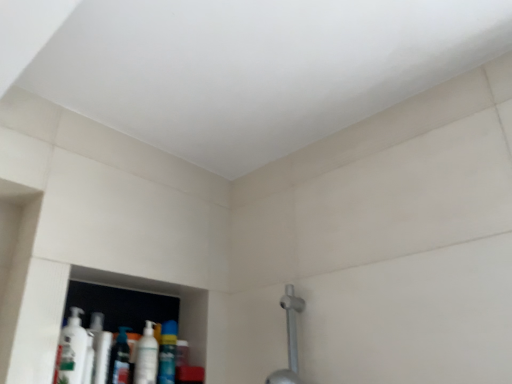
Question: Considering the relative sizes of white glossy mouthwash at lower left, arranged as the 1th mouthwash when viewed from the left, and white glossy mouthwash at lower left, which is the 2th mouthwash in right-to-left order, in the image provided, is white glossy mouthwash at lower left, arranged as the 1th mouthwash when viewed from the left, taller than white glossy mouthwash at lower left, which is the 2th mouthwash in right-to-left order,?

Choices:
 (A) no
 (B) yes

Answer: (B)

Question: Can you confirm if white glossy mouthwash at lower left, acting as the 4th mouthwash starting from the right, is positioned to the left of white glossy mouthwash at lower left, acting as the third mouthwash starting from the left?

Choices:
 (A) no
 (B) yes

Answer: (B)

Question: Can you confirm if white glossy mouthwash at lower left, acting as the 4th mouthwash starting from the right, is smaller than white glossy mouthwash at lower left, which is the 2th mouthwash in right-to-left order?

Choices:
 (A) yes
 (B) no

Answer: (B)

Question: Can you confirm if white glossy mouthwash at lower left, acting as the 4th mouthwash starting from the right, is positioned to the right of white glossy mouthwash at lower left, acting as the third mouthwash starting from the left?

Choices:
 (A) no
 (B) yes

Answer: (A)

Question: From the image's perspective, is white glossy mouthwash at lower left, acting as the 4th mouthwash starting from the right, located beneath white glossy mouthwash at lower left, acting as the third mouthwash starting from the left?

Choices:
 (A) no
 (B) yes

Answer: (A)

Question: Is point click(142, 374) positioned closer to the camera than point click(158, 380)?

Choices:
 (A) closer
 (B) farther

Answer: (A)

Question: Based on their positions, is white glossy mouthwash at lower left, which is the 2th mouthwash in right-to-left order, located to the left or right of blue glossy mouthwash at lower left, which appears as the 4th mouthwash when viewed from the left?

Choices:
 (A) left
 (B) right

Answer: (A)

Question: Considering the positions of white glossy mouthwash at lower left, which is the 2th mouthwash in right-to-left order, and blue glossy mouthwash at lower left, the 1th mouthwash when ordered from right to left, in the image, is white glossy mouthwash at lower left, which is the 2th mouthwash in right-to-left order, bigger or smaller than blue glossy mouthwash at lower left, the 1th mouthwash when ordered from right to left,?

Choices:
 (A) big
 (B) small

Answer: (A)

Question: Looking at their shapes, would you say white glossy mouthwash at lower left, acting as the third mouthwash starting from the left, is wider or thinner than blue glossy mouthwash at lower left, the 1th mouthwash when ordered from right to left?

Choices:
 (A) thin
 (B) wide

Answer: (A)

Question: From their relative heights in the image, would you say translucent plastic mouthwash at lower left, which is the second mouthwash in left-to-right order, is taller or shorter than silver metallic shower at lower right?

Choices:
 (A) short
 (B) tall

Answer: (A)

Question: Is translucent plastic mouthwash at lower left, the third mouthwash viewed from the right, in front of or behind silver metallic shower at lower right in the image?

Choices:
 (A) behind
 (B) front

Answer: (A)

Question: From a real-world perspective, is translucent plastic mouthwash at lower left, which is the second mouthwash in left-to-right order, positioned above or below silver metallic shower at lower right?

Choices:
 (A) below
 (B) above

Answer: (A)

Question: Based on their positions, is translucent plastic mouthwash at lower left, the third mouthwash viewed from the right, located to the left or right of silver metallic shower at lower right?

Choices:
 (A) left
 (B) right

Answer: (A)

Question: In the image, is blue glossy mouthwash at lower left, the 1th mouthwash when ordered from right to left, on the left side or the right side of white glossy mouthwash at lower left, which is the 2th mouthwash in right-to-left order?

Choices:
 (A) left
 (B) right

Answer: (B)

Question: Looking at the image, does blue glossy mouthwash at lower left, the 1th mouthwash when ordered from right to left, seem bigger or smaller compared to white glossy mouthwash at lower left, which is the 2th mouthwash in right-to-left order?

Choices:
 (A) big
 (B) small

Answer: (B)